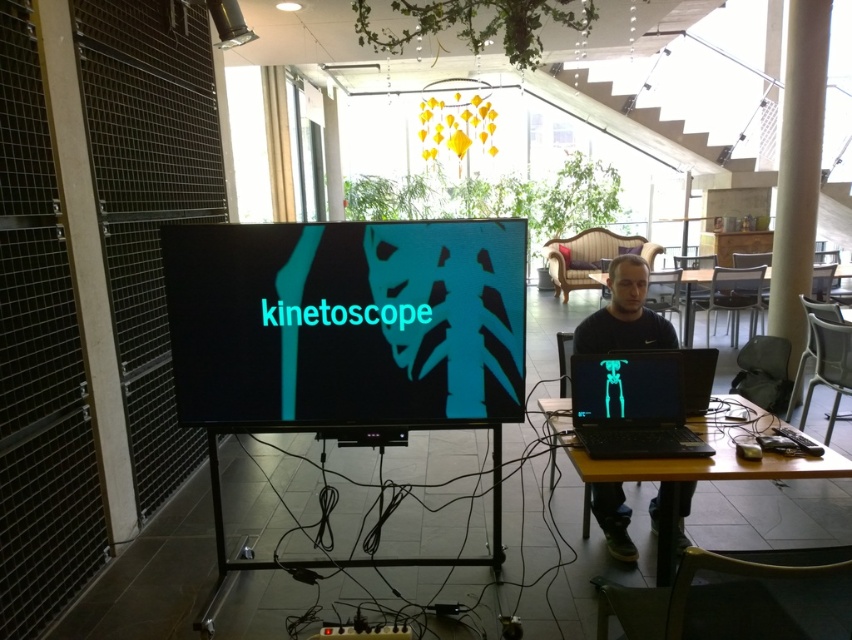
Question: Which point appears closest to the camera in this image?

Choices:
 (A) (406, 328)
 (B) (634, 301)

Answer: (A)

Question: Among these objects, which one is farthest from the camera?

Choices:
 (A) black plastic table at lower right
 (B) teal matte screen at center
 (C) black matte laptop at right
 (D) black glossy laptop at right

Answer: (C)

Question: Which of these objects is positioned farthest from the teal matte screen at center?

Choices:
 (A) black plastic table at lower right
 (B) black matte laptop at right
 (C) black glossy laptop at right

Answer: (B)

Question: Does black glossy laptop at right have a larger size compared to black matte laptop at right?

Choices:
 (A) no
 (B) yes

Answer: (A)

Question: Can you confirm if teal matte screen at center is thinner than black matte laptop at right?

Choices:
 (A) yes
 (B) no

Answer: (B)

Question: Does teal matte screen at center appear over black glossy laptop at right?

Choices:
 (A) yes
 (B) no

Answer: (A)